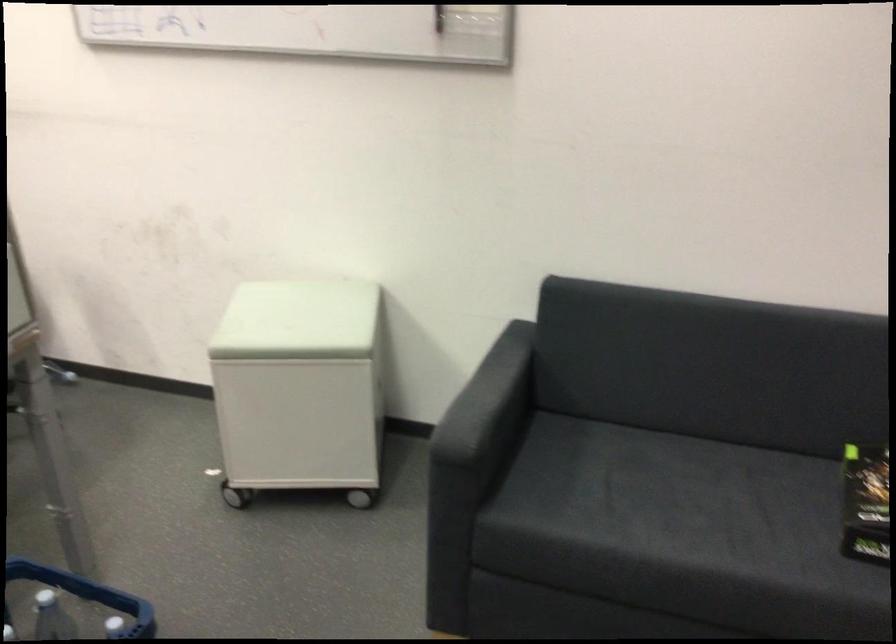
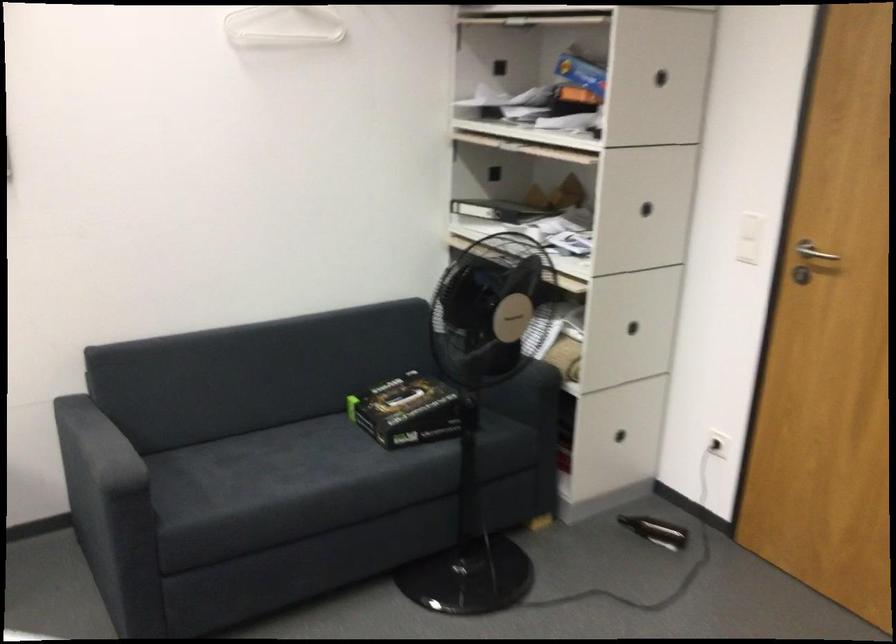
In the second image, find the point that corresponds to point 673,489 in the first image.

(268, 462)